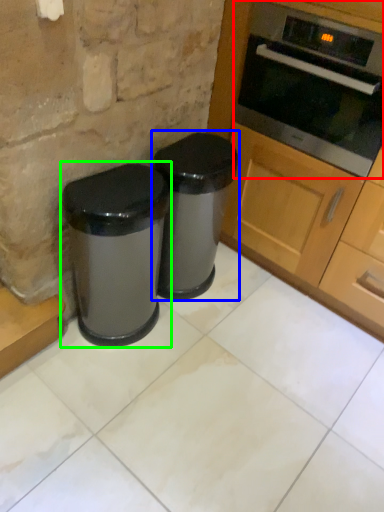
Question: Considering the real-world distances, which object is closest to oven (highlighted by a red box)? waste container (highlighted by a blue box) or waste container (highlighted by a green box).

Choices:
 (A) waste container
 (B) waste container

Answer: (A)